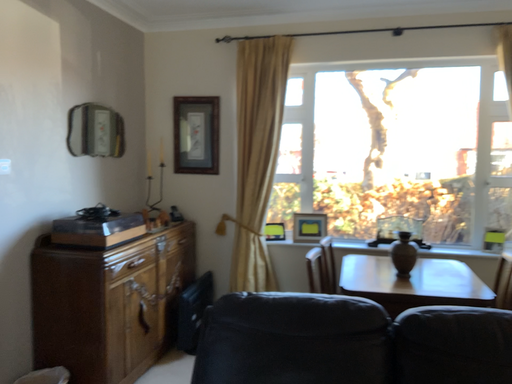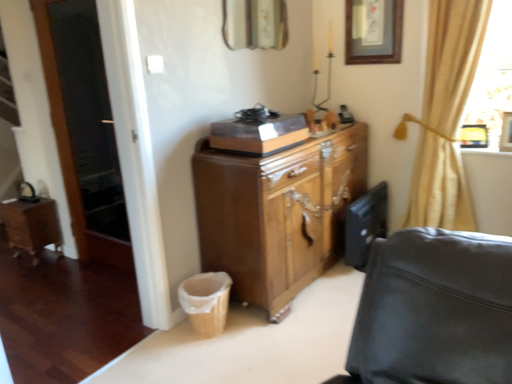
Question: Which way did the camera rotate in the video?

Choices:
 (A) rotated left
 (B) rotated right

Answer: (A)